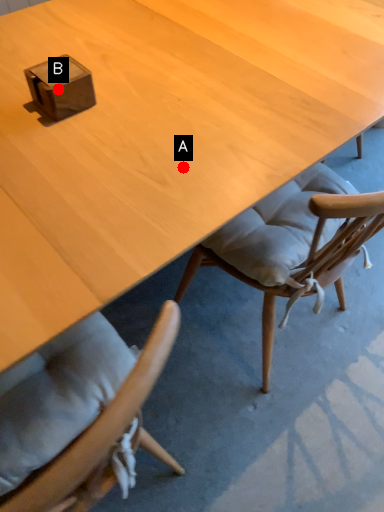
Question: Two points are circled on the image, labeled by A and B beside each circle. Which point is closer to the camera taking this photo?

Choices:
 (A) A is closer
 (B) B is closer

Answer: (A)